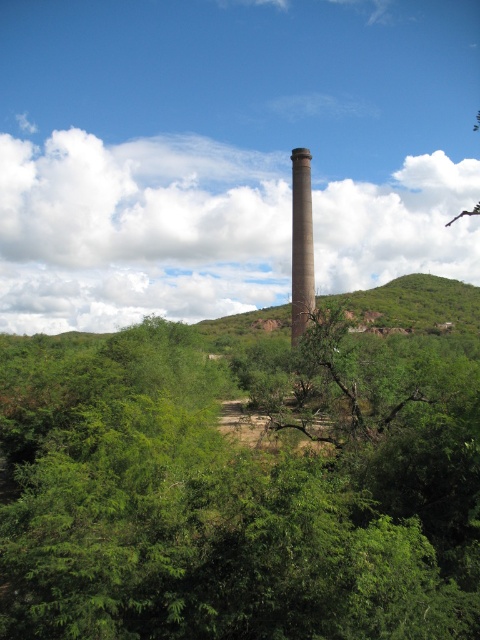
Does green leafy hillside at center have a larger size compared to brown concrete chimney at center?

Correct, green leafy hillside at center is larger in size than brown concrete chimney at center.

Does green leafy hillside at center appear under brown concrete chimney at center?

Yes.

Where is `green leafy hillside at center`? green leafy hillside at center is located at coordinates (412, 304).

Find the location of a particular element. green leafy hillside at center is located at coordinates (412, 304).

Is green leafy tree at center smaller than brown concrete chimney at center?

Indeed, green leafy tree at center has a smaller size compared to brown concrete chimney at center.

Can you confirm if green leafy tree at center is positioned to the right of brown concrete chimney at center?

No, green leafy tree at center is not to the right of brown concrete chimney at center.

Identify the location of green leafy tree at center. This screenshot has height=640, width=480. (239, 492).

Find the location of a particular element. The width and height of the screenshot is (480, 640). green leafy tree at center is located at coordinates (239, 492).

Which is more to the right, green leafy tree at center or green leafy hillside at center?

From the viewer's perspective, green leafy hillside at center appears more on the right side.

Does green leafy tree at center have a greater height compared to green leafy hillside at center?

Incorrect, green leafy tree at center's height is not larger of green leafy hillside at center's.

Is point (207, 454) closer to viewer compared to point (424, 307)?

That is True.

Identify the location of green leafy tree at center. This screenshot has height=640, width=480. (239, 492).